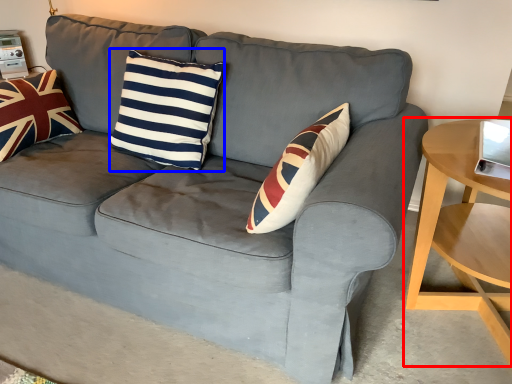
Question: Which object appears closest to the camera in this image, table (highlighted by a red box) or pillow (highlighted by a blue box)?

Choices:
 (A) table
 (B) pillow

Answer: (A)